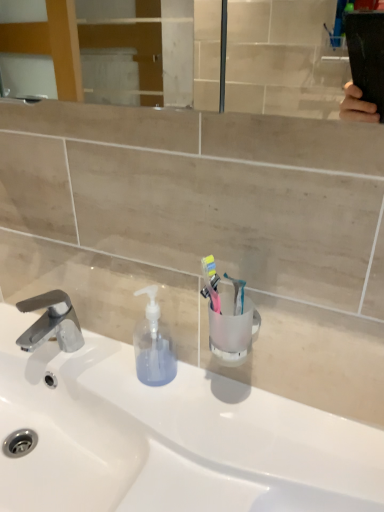
Question: Is white glossy sink at center not inside transparent plastic soap dispenser at center?

Choices:
 (A) no
 (B) yes

Answer: (B)

Question: Is white glossy sink at center in front of transparent plastic soap dispenser at center?

Choices:
 (A) yes
 (B) no

Answer: (A)

Question: Does white glossy sink at center have a larger size compared to transparent plastic soap dispenser at center?

Choices:
 (A) no
 (B) yes

Answer: (B)

Question: From a real-world perspective, is white glossy sink at center on transparent plastic soap dispenser at center?

Choices:
 (A) yes
 (B) no

Answer: (B)

Question: Could you tell me if white glossy sink at center is turned towards transparent plastic soap dispenser at center?

Choices:
 (A) yes
 (B) no

Answer: (B)

Question: Visually, is translucent plastic toothbrush at center, which is counted as the first toothbrush, starting from the left, positioned to the left or to the right of transparent plastic soap dispenser at center?

Choices:
 (A) right
 (B) left

Answer: (A)

Question: In the image, is translucent plastic toothbrush at center, which is counted as the first toothbrush, starting from the left, positioned in front of or behind transparent plastic soap dispenser at center?

Choices:
 (A) behind
 (B) front

Answer: (B)

Question: From a real-world perspective, is translucent plastic toothbrush at center, which appears as the second toothbrush when viewed from the right, positioned above or below transparent plastic soap dispenser at center?

Choices:
 (A) below
 (B) above

Answer: (B)

Question: Is translucent plastic toothbrush at center, which is counted as the first toothbrush, starting from the left, taller or shorter than transparent plastic soap dispenser at center?

Choices:
 (A) short
 (B) tall

Answer: (A)

Question: Would you say translucent plastic toothbrush at center, which is counted as the first toothbrush, starting from the left, is inside or outside translucent plastic toothbrush at center, the second toothbrush from the left?

Choices:
 (A) outside
 (B) inside

Answer: (A)

Question: From the image's perspective, is translucent plastic toothbrush at center, which appears as the second toothbrush when viewed from the right, above or below translucent plastic toothbrush at center, the first toothbrush positioned from the right?

Choices:
 (A) below
 (B) above

Answer: (A)

Question: Considering the positions of translucent plastic toothbrush at center, which appears as the second toothbrush when viewed from the right, and translucent plastic toothbrush at center, the first toothbrush positioned from the right, in the image, is translucent plastic toothbrush at center, which appears as the second toothbrush when viewed from the right, taller or shorter than translucent plastic toothbrush at center, the first toothbrush positioned from the right,?

Choices:
 (A) tall
 (B) short

Answer: (B)

Question: Is translucent plastic toothbrush at center, which is counted as the first toothbrush, starting from the left, in front of or behind translucent plastic toothbrush at center, the second toothbrush from the left, in the image?

Choices:
 (A) front
 (B) behind

Answer: (A)

Question: Is point (21, 352) positioned closer to the camera than point (218, 308)?

Choices:
 (A) farther
 (B) closer

Answer: (A)

Question: Considering the positions of white glossy sink at center and translucent plastic toothbrush at center, which appears as the second toothbrush when viewed from the right, in the image, is white glossy sink at center taller or shorter than translucent plastic toothbrush at center, which appears as the second toothbrush when viewed from the right,?

Choices:
 (A) tall
 (B) short

Answer: (A)